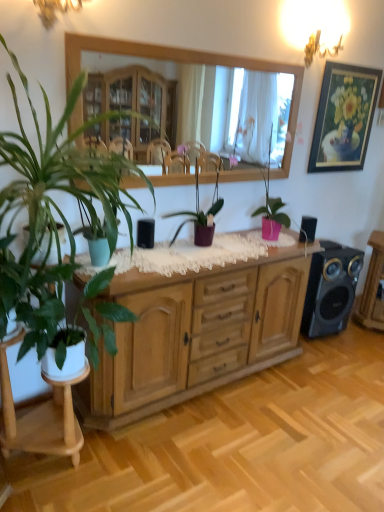
Describe the element at coordinates (145, 233) in the screenshot. I see `black matte speaker at center, the 3th speaker positioned from the right` at that location.

Identify the location of pink matte plant at center, which ranks as the 4th houseplant in left-to-right order. (271, 210).

At what (x,y) coordinates should I click in order to perform the action: click on green matte plant at left, which is the second houseplant from left to right. Please return your answer as a coordinate pair (x, y). Looking at the image, I should click on (53, 217).

Find the location of a particular element. green matte plant at left, the 4th houseplant viewed from the right is located at coordinates (39, 304).

At what (x,y) coordinates should I click in order to perform the action: click on wooden cabinet at center. Please return your answer as a coordinate pair (x, y). Looking at the image, I should click on (196, 334).

Is green matte plant at left positioned behind wooden mirror at upper center?

That is False.

Is green matte plant at left placed right next to wooden mirror at upper center?

green matte plant at left and wooden mirror at upper center are clearly separated.

Is green matte plant at left positioned with its back to wooden mirror at upper center?

Yes, green matte plant at left is positioned with its back facing wooden mirror at upper center.

From the picture: Is the position of black glossy speaker at right, the first speaker in the right-to-left sequence, more distant than that of gold-framed painting at upper right?

Yes, black glossy speaker at right, the first speaker in the right-to-left sequence, is further from the camera.

From the image's perspective, which one is positioned lower, black glossy speaker at right, which ranks as the third speaker in front-to-back order, or gold-framed painting at upper right?

black glossy speaker at right, which ranks as the third speaker in front-to-back order, is shown below in the image.

In the scene shown: Does black glossy speaker at right, which ranks as the third speaker in front-to-back order, touch gold-framed painting at upper right?

They are not placed beside each other.

From a real-world perspective, between black glossy speaker at right, the first speaker in the right-to-left sequence, and gold-framed painting at upper right, who is vertically lower?

In real-world perspective, black glossy speaker at right, the first speaker in the right-to-left sequence, is lower.

From the picture: Measure the distance between wooden mirror at upper center and green matte plant at left.

A distance of 18.78 inches exists between wooden mirror at upper center and green matte plant at left.

Is wooden mirror at upper center turned away from green matte plant at left?

wooden mirror at upper center does not have its back to green matte plant at left.

From the image's perspective, does wooden mirror at upper center appear lower than green matte plant at left?

No, from the image's perspective, wooden mirror at upper center is not beneath green matte plant at left.

From a real-world perspective, which is physically below, wooden mirror at upper center or green matte plant at left?

green matte plant at left.

How distant is wooden cabinet at center from black plastic speaker at right, acting as the second speaker starting from the back?

wooden cabinet at center and black plastic speaker at right, acting as the second speaker starting from the back, are 80.56 centimeters apart.

Where is `cabinetry below the black plastic speaker at right, acting as the second speaker starting from the left (from the image's perspective)`? cabinetry below the black plastic speaker at right, acting as the second speaker starting from the left (from the image's perspective) is located at coordinates (196, 334).

Considering the sizes of objects wooden cabinet at center and black plastic speaker at right, the second speaker from the right, in the image provided, who is taller, wooden cabinet at center or black plastic speaker at right, the second speaker from the right,?

With more height is wooden cabinet at center.

Which of these two, wooden cabinet at center or black plastic speaker at right, the second speaker from the right, is thinner?

black plastic speaker at right, the second speaker from the right.

Is white lace cloth at center positioned far away from black plastic speaker at right, acting as the second speaker starting from the back?

No, white lace cloth at center is in close proximity to black plastic speaker at right, acting as the second speaker starting from the back.

Considering the sizes of objects white lace cloth at center and black plastic speaker at right, acting as the second speaker starting from the back, in the image provided, who is bigger, white lace cloth at center or black plastic speaker at right, acting as the second speaker starting from the back,?

white lace cloth at center.

Looking at their sizes, would you say white lace cloth at center is wider or thinner than black plastic speaker at right, the second speaker from the right?

Considering their sizes, white lace cloth at center looks broader than black plastic speaker at right, the second speaker from the right.

From the image's perspective, between pink matte plant at center, which ranks as the 4th houseplant in left-to-right order, and green matte plant at left, the first houseplant from the left, who is located below?

green matte plant at left, the first houseplant from the left, is shown below in the image.

Is pink matte plant at center, which is the 1th houseplant in right-to-left order, positioned beyond the bounds of green matte plant at left, the 4th houseplant viewed from the right?

Yes.

What's the angular difference between pink matte plant at center, which ranks as the 4th houseplant in left-to-right order, and green matte plant at left, the first houseplant from the left,'s facing directions?

3.25 degrees separate the facing orientations of pink matte plant at center, which ranks as the 4th houseplant in left-to-right order, and green matte plant at left, the first houseplant from the left.

What's the angular difference between black plastic speaker at right, the second speaker from the right, and green matte plant at left, marked as the third houseplant in a right-to-left arrangement,'s facing directions?

The angular difference between black plastic speaker at right, the second speaker from the right, and green matte plant at left, marked as the third houseplant in a right-to-left arrangement, is 8.1 degrees.

Is black plastic speaker at right, the second speaker from the right, spatially inside green matte plant at left, which is the second houseplant from left to right, or outside of it?

black plastic speaker at right, the second speaker from the right, is not enclosed by green matte plant at left, which is the second houseplant from left to right.

Considering their positions, is black plastic speaker at right, the second speaker from the right, located in front of or behind green matte plant at left, which is the second houseplant from left to right?

Clearly, black plastic speaker at right, the second speaker from the right, is behind green matte plant at left, which is the second houseplant from left to right.

Could you tell me if black plastic speaker at right, acting as the second speaker starting from the back, is turned towards green matte plant at left, which is the second houseplant from left to right?

No, black plastic speaker at right, acting as the second speaker starting from the back, is not oriented towards green matte plant at left, which is the second houseplant from left to right.

I want to click on mirror behind the green matte plant at left, so click(x=188, y=63).

Find the location of a particular element. This screenshot has width=384, height=512. picture frame on the right of black glossy speaker at right, the first speaker in the right-to-left sequence is located at coordinates (344, 117).

Looking at the image, which one is located closer to green matte plant at left, the 4th houseplant viewed from the right, matte gold sconce at upper left, arranged as the second lamp when viewed from the back, or black matte speaker at center, marked as the 1th speaker in a front-to-back arrangement?

black matte speaker at center, marked as the 1th speaker in a front-to-back arrangement, is positioned closer to the anchor green matte plant at left, the 4th houseplant viewed from the right.

Based on their spatial positions, is black plastic speaker at right, the second speaker from the right, or purple matte plant at center, the second houseplant in the right-to-left sequence, closer to black matte speaker at center, marked as the 1th speaker in a front-to-back arrangement?

purple matte plant at center, the second houseplant in the right-to-left sequence.

Estimate the real-world distances between objects in this image. Which object is further from green matte plant at left, the 4th houseplant viewed from the right, wooden cabinet at center or green matte plant at left, marked as the third houseplant in a right-to-left arrangement?

wooden cabinet at center.

Based on the photo, estimate the real-world distances between objects in this image. Which object is closer to green matte plant at left, the 4th houseplant viewed from the right, green matte plant at left, marked as the third houseplant in a right-to-left arrangement, or black glossy speaker at right, placed as the 3th speaker when sorted from left to right?

green matte plant at left, marked as the third houseplant in a right-to-left arrangement, is closer to green matte plant at left, the 4th houseplant viewed from the right.

When comparing their distances from green matte plant at left, the 4th houseplant viewed from the right, does black matte speaker at center, marked as the 1th speaker in a front-to-back arrangement, or white lace cloth at center seem closer?

white lace cloth at center.

Based on their spatial positions, is purple matte plant at center, placed as the third houseplant when sorted from left to right, or wooden cabinet at center further from black plastic speaker at right, the 2th speaker when ordered from front to back?

wooden cabinet at center.

From the picture: When comparing their distances from green matte plant at left, which is the second houseplant from left to right, does gold-framed painting at upper right or black glossy speaker at right, which ranks as the third speaker in front-to-back order, seem further?

Among the two, gold-framed painting at upper right is located further to green matte plant at left, which is the second houseplant from left to right.

When comparing their distances from metallic gold chandelier at upper right, the 1th lamp viewed from the right, does black matte speaker at center, the 3th speaker positioned from the right, or pink matte plant at center, which ranks as the 4th houseplant in left-to-right order, seem further?

black matte speaker at center, the 3th speaker positioned from the right, lies further to metallic gold chandelier at upper right, the 1th lamp viewed from the right, than the other object.

At what (x,y) coordinates should I click in order to perform the action: click on lamp between matte gold sconce at upper left, which is the 1th lamp in left-to-right order, and black glossy speaker at right, arranged as the first speaker when viewed from the back, in the horizontal direction. Please return your answer as a coordinate pair (x, y). Image resolution: width=384 pixels, height=512 pixels. Looking at the image, I should click on (325, 32).

The image size is (384, 512). I want to click on speaker between purple matte plant at center, placed as the third houseplant when sorted from left to right, and black glossy speaker at right, arranged as the first speaker when viewed from the back, so click(x=307, y=229).

At what (x,y) coordinates should I click in order to perform the action: click on plant positioned between green matte plant at left, marked as the third houseplant in a right-to-left arrangement, and black plastic speaker at right, acting as the second speaker starting from the left, from near to far. Please return your answer as a coordinate pair (x, y). Looking at the image, I should click on (109, 202).

Locate an element on the screen. plant located between matte gold sconce at upper left, the 2th lamp in the right-to-left sequence, and gold-framed painting at upper right in the left-right direction is located at coordinates (109, 202).